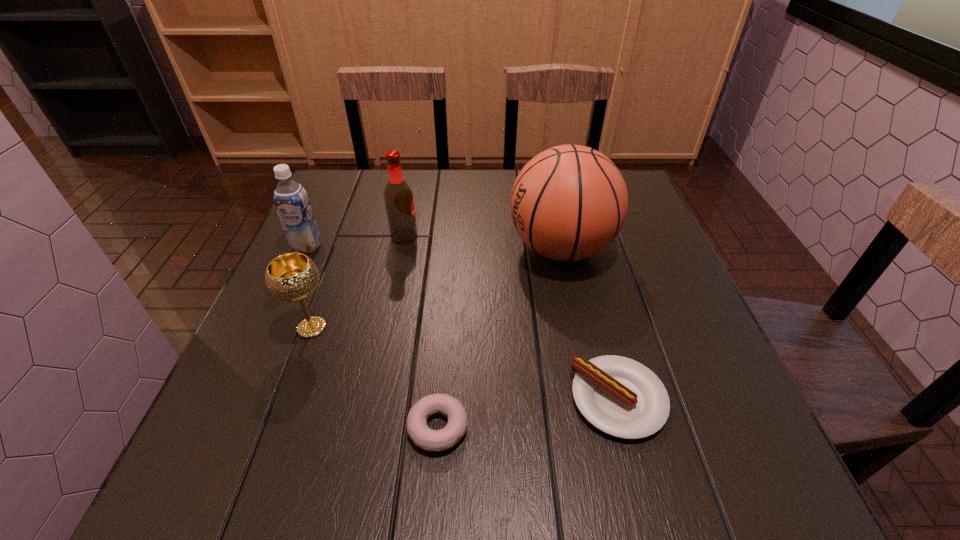
This screenshot has width=960, height=540. I want to click on vacant space in between the doughnut and the leftmost object, so click(x=372, y=337).

Image resolution: width=960 pixels, height=540 pixels. In order to click on empty space between the soya milk and the shortest object in this screenshot , I will do `click(372, 337)`.

The width and height of the screenshot is (960, 540). What are the coordinates of `vacant space that is in between the leftmost object and the sausage` in the screenshot? It's located at (463, 323).

Locate an element on the screen. The image size is (960, 540). vacant area that lies between the doughnut and the chalice is located at coordinates (375, 377).

Image resolution: width=960 pixels, height=540 pixels. Find the location of `free space between the third object from right to left and the second shortest object`. free space between the third object from right to left and the second shortest object is located at coordinates (528, 413).

You are a GUI agent. You are given a task and a screenshot of the screen. Output one action in this format:
    pyautogui.click(x=<x>, y=<y>)
    Task: Click on the empty space between the beer bottle and the second shortest object
    This screenshot has height=540, width=960.
    Given the screenshot: What is the action you would take?
    pyautogui.click(x=512, y=318)

What are the coordinates of `vacant area that lies between the basketball and the second shortest object` in the screenshot? It's located at (589, 324).

The height and width of the screenshot is (540, 960). Find the location of `free space between the fourth object from right to left and the basketball`. free space between the fourth object from right to left and the basketball is located at coordinates (x=483, y=243).

This screenshot has height=540, width=960. I want to click on object that stands as the fifth closest to the soya milk, so click(621, 397).

Locate which object ranks in proximity to the second shortest object. Please provide its 2D coordinates. Your answer should be formatted as a tuple, i.e. [(x, y)], where the tuple contains the x and y coordinates of a point satisfying the conditions above.

[(422, 436)]